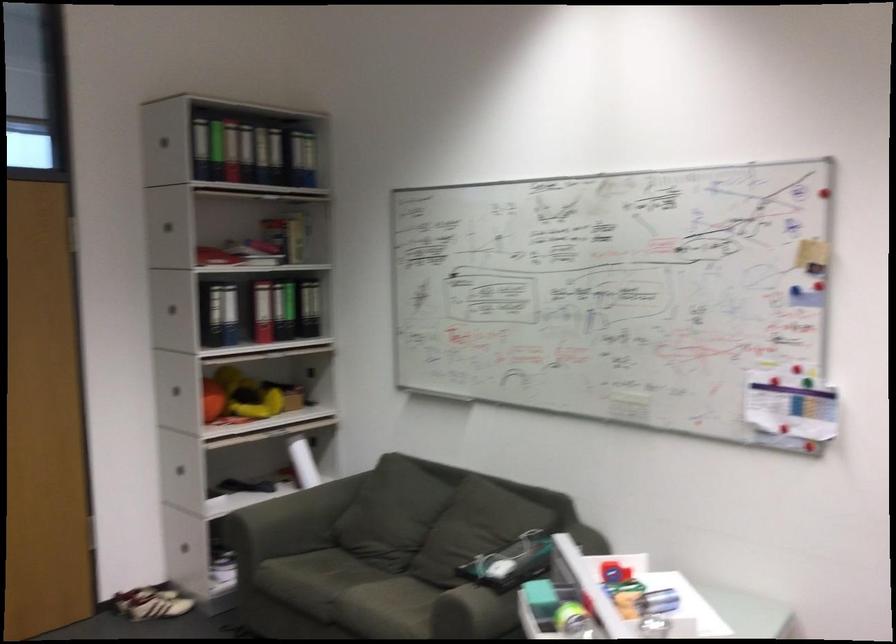
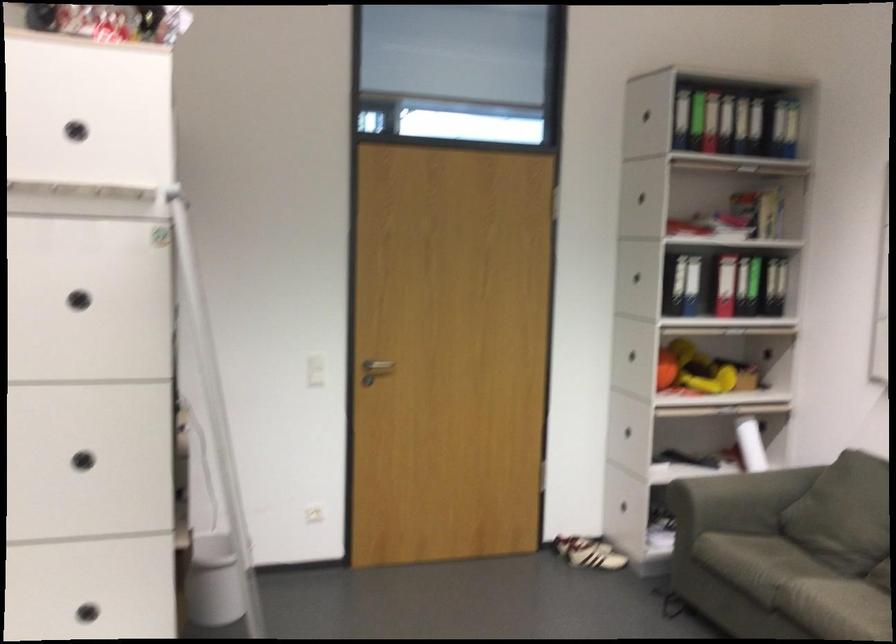
Where in the second image is the point corresponding to (x=280, y=182) from the first image?

(764, 126)